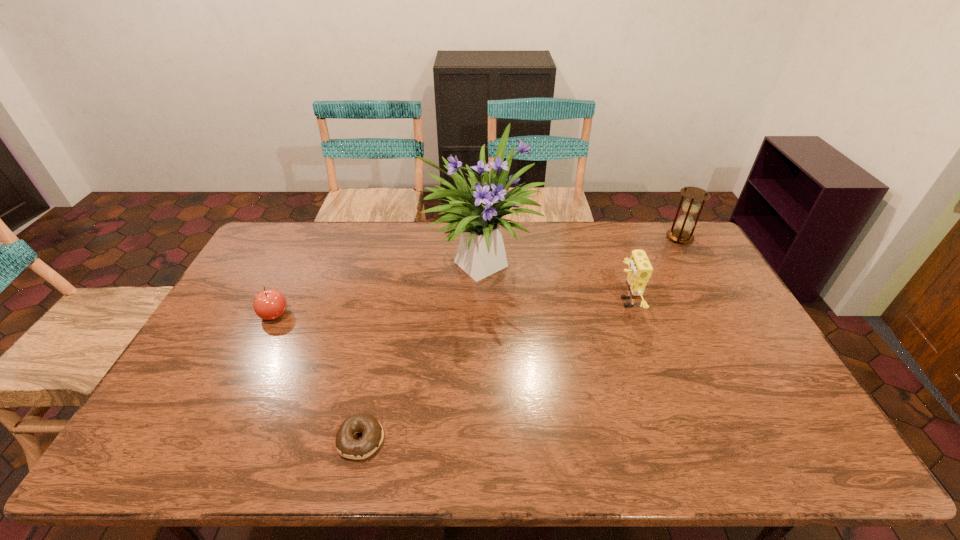
At what (x,y) coordinates should I click in order to perform the action: click on object located at the far right corner. Please return your answer as a coordinate pair (x, y). The width and height of the screenshot is (960, 540). Looking at the image, I should click on (685, 223).

In the image, there is a desktop. Identify the location of free space at the far edge. (324, 222).

Identify the location of vacant region at the near edge of the desktop. (741, 450).

This screenshot has height=540, width=960. In the image, there is a desktop. In order to click on vacant space at the left edge in this screenshot , I will do `click(207, 407)`.

Find the location of a particular element. free space at the right edge of the desktop is located at coordinates tap(752, 421).

The width and height of the screenshot is (960, 540). I want to click on free region at the far left corner of the desktop, so click(267, 260).

Locate an element on the screen. vacant space at the far right corner is located at coordinates (660, 240).

The height and width of the screenshot is (540, 960). I want to click on vacant space that's between the leftmost object and the fourth object from left to right, so click(x=450, y=308).

In order to click on vacant space that is in between the fourth object from right to left and the apple in this screenshot , I will do `click(318, 377)`.

Where is `free space between the apple and the doughnut`? This screenshot has width=960, height=540. free space between the apple and the doughnut is located at coordinates (318, 377).